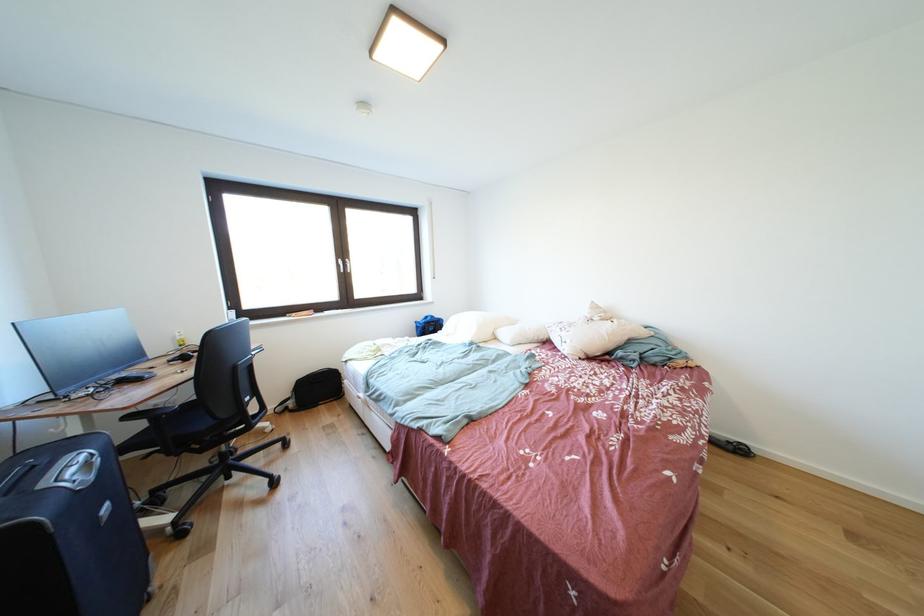
You are a GUI agent. You are given a task and a screenshot of the screen. Output one action in this format:
    pyautogui.click(x=<x>, y=<y>)
    Task: Click on the suitcase top handle
    
    Given the screenshot: What is the action you would take?
    pyautogui.click(x=75, y=466)